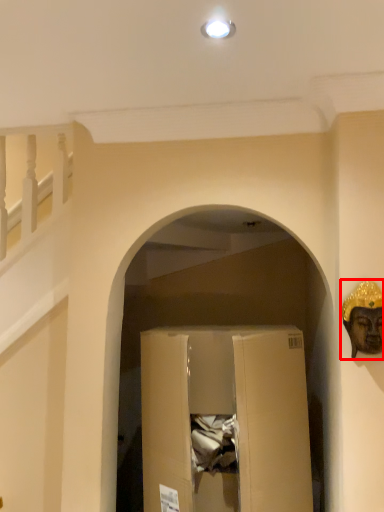
Question: From the image's perspective, where is construction worker (annotated by the red box) located in relation to cardboard box in the image?

Choices:
 (A) below
 (B) above

Answer: (B)